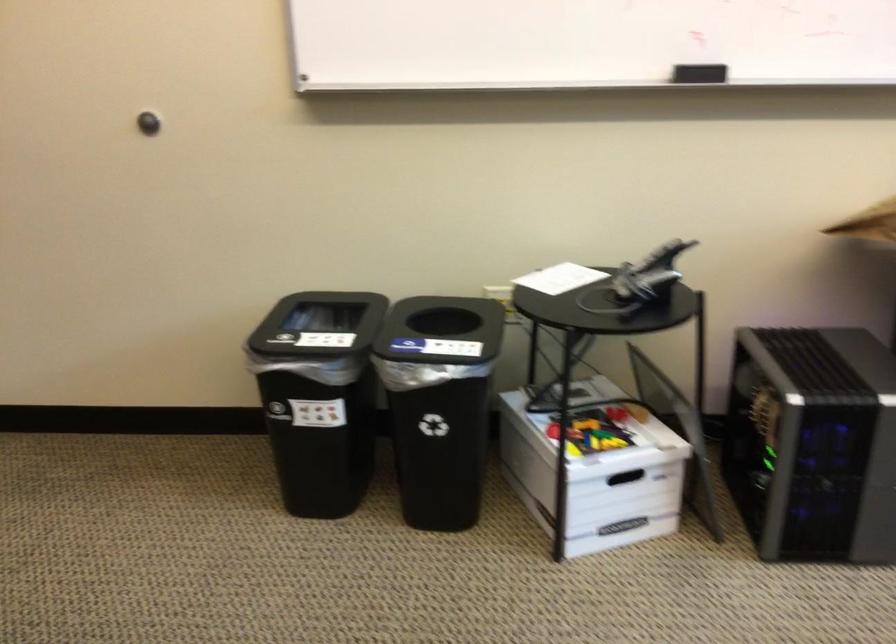
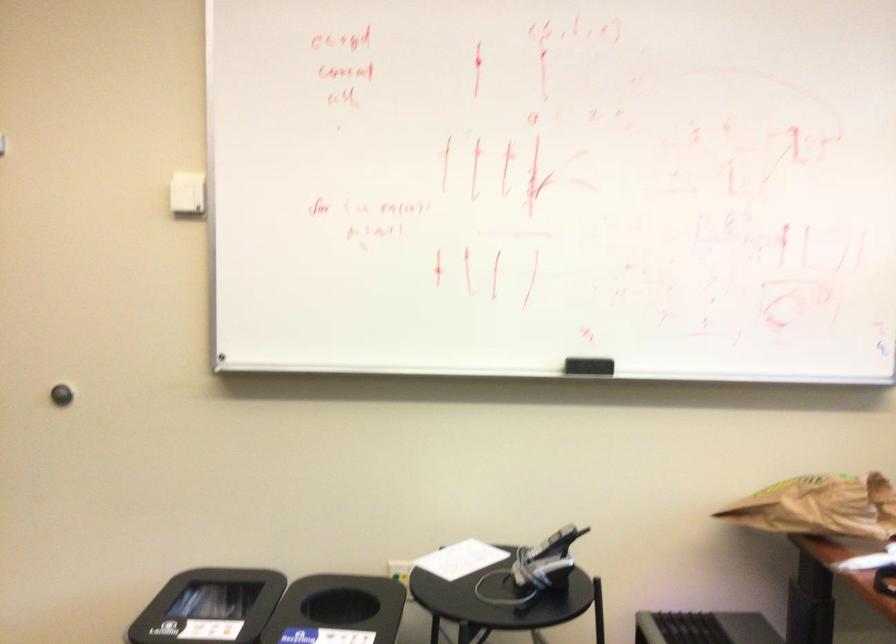
The point at (662, 260) is marked in the first image. Where is the corresponding point in the second image?

(552, 544)